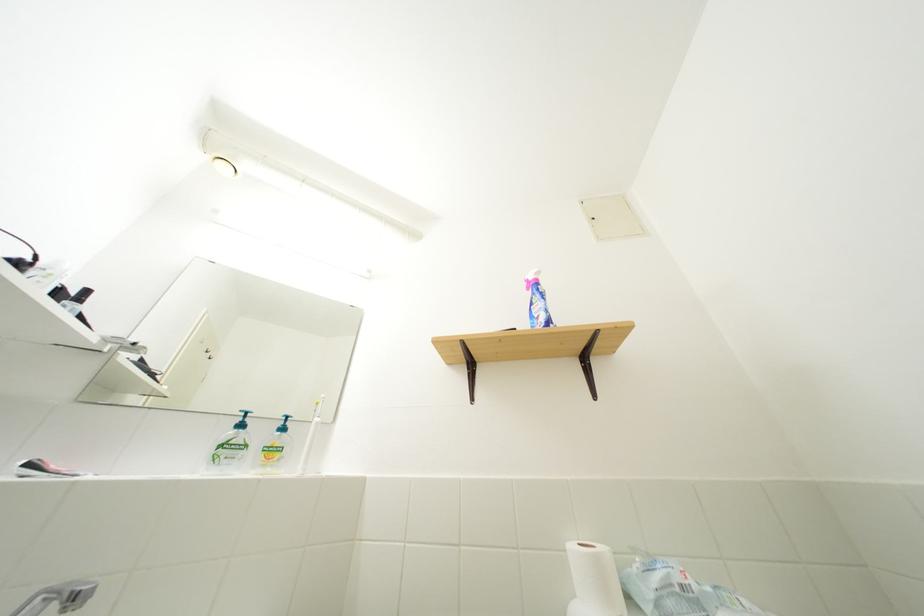
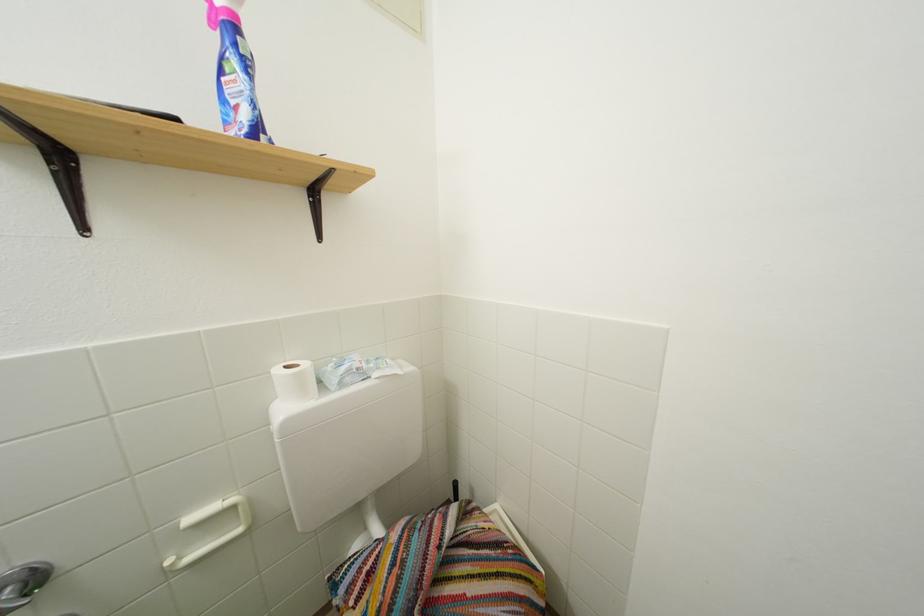
The images are taken continuously from a first-person perspective. In which direction is your viewpoint rotating?

The camera's rotation is toward right-down.